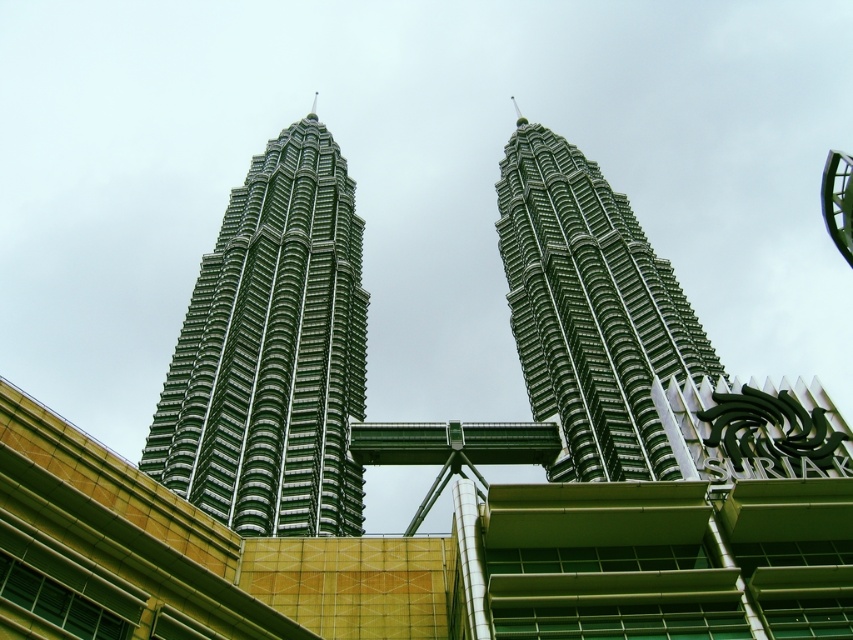
Is green glassy skyscraper at center to the right of green metallic twin towers at center from the viewer's perspective?

Incorrect, green glassy skyscraper at center is not on the right side of green metallic twin towers at center.

Is green glassy skyscraper at center smaller than green metallic twin towers at center?

Indeed, green glassy skyscraper at center has a smaller size compared to green metallic twin towers at center.

The height and width of the screenshot is (640, 853). In order to click on green glassy skyscraper at center in this screenshot , I will do `click(271, 353)`.